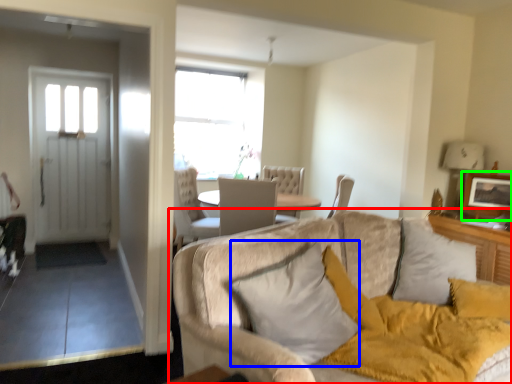
Question: Based on their relative distances, which object is farther from studio couch (highlighted by a red box)? Choose from pillow (highlighted by a blue box) and picture frame (highlighted by a green box).

Choices:
 (A) pillow
 (B) picture frame

Answer: (B)